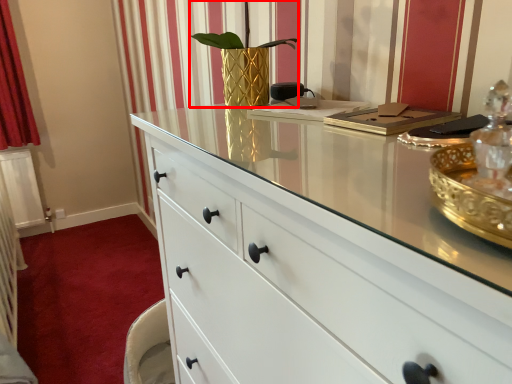
Question: In this image, where is plant (annotated by the red box) located relative to plain?

Choices:
 (A) right
 (B) left

Answer: (A)